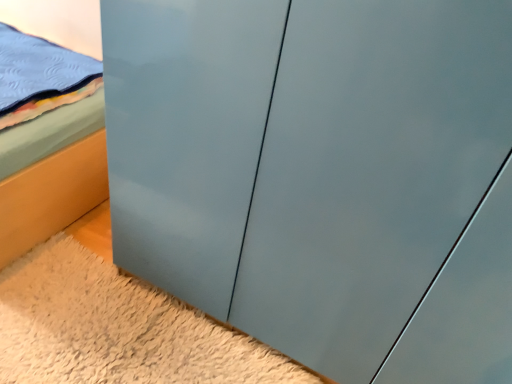
Where is `vacant area on top of matte gray cabinet at lower center (from a real-world perspective)`? vacant area on top of matte gray cabinet at lower center (from a real-world perspective) is located at coordinates (124, 327).